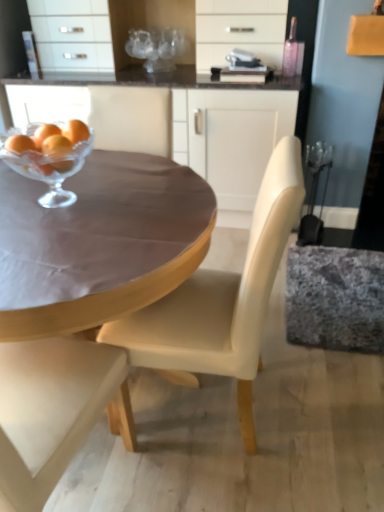
Question: Is matte cream chair at center a part of translucent glass tangerine at upper left?

Choices:
 (A) no
 (B) yes

Answer: (A)

Question: Is the depth of translucent glass tangerine at upper left less than that of matte cream chair at center?

Choices:
 (A) no
 (B) yes

Answer: (A)

Question: Is translucent glass tangerine at upper left in contact with matte cream chair at center?

Choices:
 (A) yes
 (B) no

Answer: (B)

Question: Is translucent glass tangerine at upper left far from matte cream chair at center?

Choices:
 (A) yes
 (B) no

Answer: (B)

Question: Is translucent glass tangerine at upper left aimed at matte cream chair at center?

Choices:
 (A) no
 (B) yes

Answer: (A)

Question: Is translucent glass tangerine at upper left at the right side of matte cream chair at center?

Choices:
 (A) no
 (B) yes

Answer: (A)

Question: From a real-world perspective, is granite-like fabric swivel chair at right physically above matte brown table at center?

Choices:
 (A) no
 (B) yes

Answer: (A)

Question: Is the depth of granite-like fabric swivel chair at right greater than that of matte brown table at center?

Choices:
 (A) no
 (B) yes

Answer: (B)

Question: Is granite-like fabric swivel chair at right looking in the opposite direction of matte brown table at center?

Choices:
 (A) yes
 (B) no

Answer: (B)

Question: Are granite-like fabric swivel chair at right and matte brown table at center making contact?

Choices:
 (A) yes
 (B) no

Answer: (B)

Question: Can you confirm if granite-like fabric swivel chair at right is taller than matte brown table at center?

Choices:
 (A) no
 (B) yes

Answer: (A)

Question: Is matte brown table at center a part of granite-like fabric swivel chair at right?

Choices:
 (A) no
 (B) yes

Answer: (A)

Question: Can you confirm if matte white cabinet at upper center is shorter than translucent glass tangerine at upper left?

Choices:
 (A) no
 (B) yes

Answer: (A)